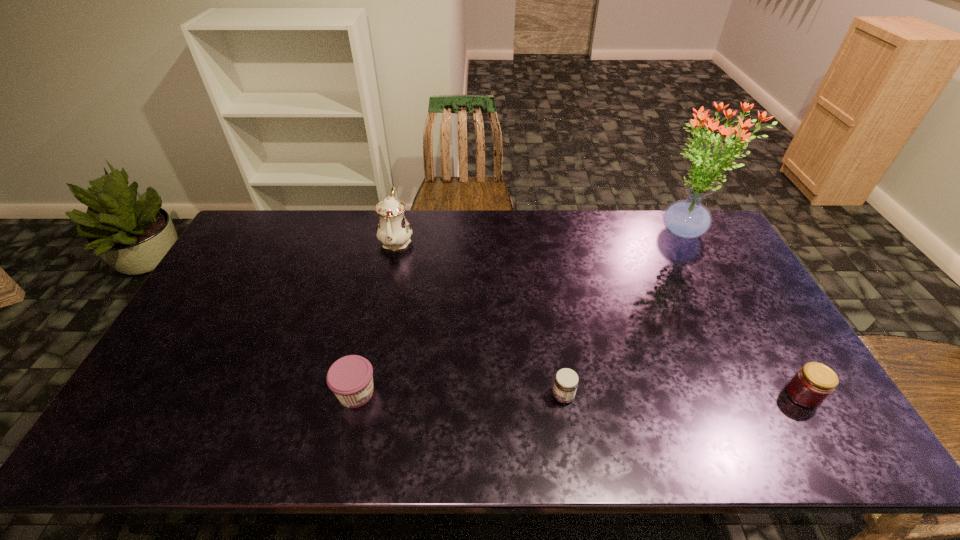
Locate an element on the screen. The height and width of the screenshot is (540, 960). the tallest object is located at coordinates (687, 219).

Find the location of a particular element. This screenshot has height=540, width=960. chinaware is located at coordinates (394, 231).

Where is `the rightmost jam`? the rightmost jam is located at coordinates (813, 383).

The width and height of the screenshot is (960, 540). Find the location of `the leftmost jam`. the leftmost jam is located at coordinates (350, 378).

Find the location of a particular element. The height and width of the screenshot is (540, 960). the second jam from right to left is located at coordinates point(565,385).

The image size is (960, 540). I want to click on vacant area situated on the left of the flower arrangement, so click(x=551, y=234).

You are a GUI agent. You are given a task and a screenshot of the screen. Output one action in this format:
    pyautogui.click(x=<x>, y=<y>)
    Task: Click on the blank space located on the left of the chinaware
    The image size is (960, 540).
    Given the screenshot: What is the action you would take?
    pyautogui.click(x=319, y=240)

The image size is (960, 540). Identify the location of free point located on the left of the rightmost jam. (632, 395).

The height and width of the screenshot is (540, 960). Identify the location of vacant space located 0.290m on the front label of the leftmost jam. (492, 393).

Locate an element on the screen. This screenshot has width=960, height=540. vacant point located on the front label of the third object from right to left is located at coordinates (520, 396).